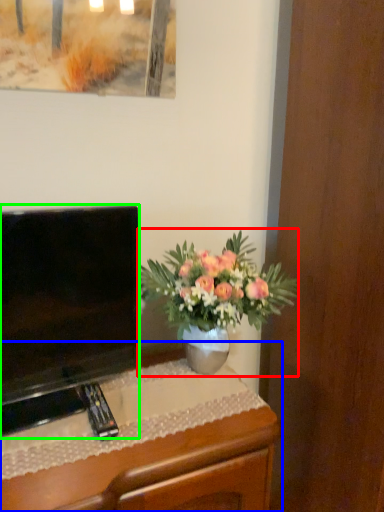
Question: Estimate the real-world distances between objects in this image. Which object is farther from houseplant (highlighted by a red box), desk (highlighted by a blue box) or television (highlighted by a green box)?

Choices:
 (A) desk
 (B) television

Answer: (A)